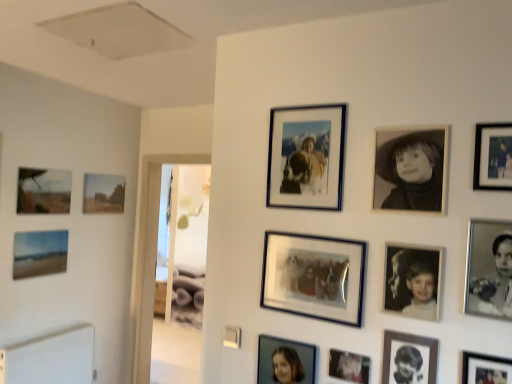
Question: Which direction should I rotate to look at matte silver photo frame at lower center, placed as the tenth picture frame when sorted from front to back?

Choices:
 (A) right
 (B) left

Answer: (A)

Question: Is metallic silver photo frame at lower right, the 2th picture frame from the front, located outside metallic silver photo frame at lower center, which is the 7th picture frame in back-to-front order?

Choices:
 (A) no
 (B) yes

Answer: (B)

Question: Is metallic silver photo frame at lower right, the 2th picture frame from the front, to the left of metallic silver photo frame at lower center, positioned as the seventh picture frame in left-to-right order, from the viewer's perspective?

Choices:
 (A) yes
 (B) no

Answer: (B)

Question: Can you confirm if metallic silver photo frame at lower right, which is the 11th picture frame in left-to-right order, is taller than metallic silver photo frame at lower center, the seventh picture frame from the right?

Choices:
 (A) no
 (B) yes

Answer: (B)

Question: Can you confirm if metallic silver photo frame at lower right, the 2th picture frame from the front, is bigger than metallic silver photo frame at lower center, positioned as the seventh picture frame in left-to-right order?

Choices:
 (A) yes
 (B) no

Answer: (A)

Question: Is metallic silver photo frame at lower right, which is the 11th picture frame in left-to-right order, beside metallic silver photo frame at lower center, placed as the 7th picture frame when sorted from front to back?

Choices:
 (A) no
 (B) yes

Answer: (A)

Question: Considering the relative sizes of metallic silver photo frame at lower right, which is the 11th picture frame in left-to-right order, and metallic silver photo frame at lower center, placed as the 7th picture frame when sorted from front to back, in the image provided, is metallic silver photo frame at lower right, which is the 11th picture frame in left-to-right order, thinner than metallic silver photo frame at lower center, placed as the 7th picture frame when sorted from front to back,?

Choices:
 (A) no
 (B) yes

Answer: (A)

Question: Is matte silver photo frame at lower center, the fourth picture frame when ordered from left to right, at the right side of metallic silver photo frame at lower center, which is the 7th picture frame in back-to-front order?

Choices:
 (A) no
 (B) yes

Answer: (A)

Question: From a real-world perspective, is matte silver photo frame at lower center, the 10th picture frame positioned from the right, physically above metallic silver photo frame at lower center, the seventh picture frame from the right?

Choices:
 (A) yes
 (B) no

Answer: (B)

Question: From the image's perspective, would you say matte silver photo frame at lower center, the 10th picture frame positioned from the right, is shown under metallic silver photo frame at lower center, placed as the 7th picture frame when sorted from front to back?

Choices:
 (A) yes
 (B) no

Answer: (A)

Question: Is matte silver photo frame at lower center, which is the fourth picture frame in back-to-front order, facing towards metallic silver photo frame at lower center, which is the 7th picture frame in back-to-front order?

Choices:
 (A) yes
 (B) no

Answer: (B)

Question: Does matte silver photo frame at lower center, placed as the tenth picture frame when sorted from front to back, come in front of metallic silver photo frame at lower center, placed as the 7th picture frame when sorted from front to back?

Choices:
 (A) no
 (B) yes

Answer: (A)

Question: Considering the relative sizes of matte silver photo frame at lower center, the fourth picture frame when ordered from left to right, and metallic silver photo frame at lower center, placed as the 7th picture frame when sorted from front to back, in the image provided, is matte silver photo frame at lower center, the fourth picture frame when ordered from left to right, wider than metallic silver photo frame at lower center, placed as the 7th picture frame when sorted from front to back,?

Choices:
 (A) yes
 (B) no

Answer: (A)

Question: Considering the relative positions of metallic silver photo frame at lower center, placed as the 7th picture frame when sorted from front to back, and matte blue painting at lower left, which ranks as the 1th picture frame in left-to-right order, in the image provided, is metallic silver photo frame at lower center, placed as the 7th picture frame when sorted from front to back, to the left of matte blue painting at lower left, which ranks as the 1th picture frame in left-to-right order, from the viewer's perspective?

Choices:
 (A) no
 (B) yes

Answer: (A)